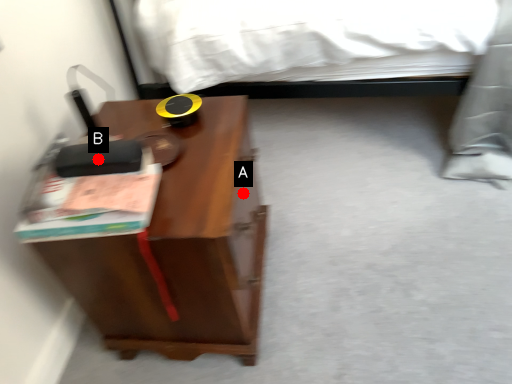
Question: Two points are circled on the image, labeled by A and B beside each circle. Which of the following is the farthest from the observer?

Choices:
 (A) A is further
 (B) B is further

Answer: (A)